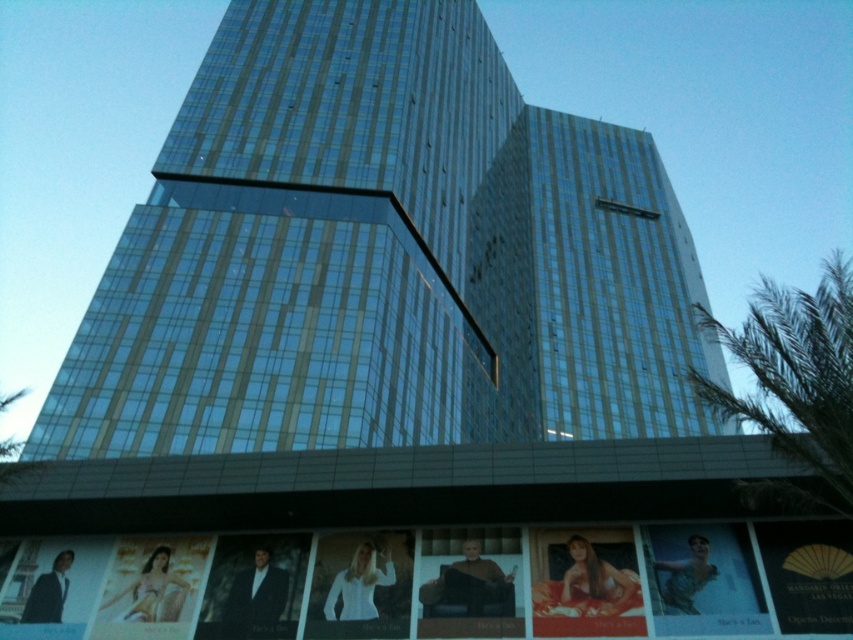
Question: Is glassy metallic building at center thinner than matte black suit at lower left?

Choices:
 (A) no
 (B) yes

Answer: (A)

Question: Observing the image, what is the correct spatial positioning of matte red fabric at center in reference to matte black suit at lower left?

Choices:
 (A) above
 (B) below

Answer: (A)

Question: Which of these objects is positioned farthest from the matte red fabric at center?

Choices:
 (A) matte gold poster at lower left
 (B) matte black poster at lower left
 (C) green leafy palm tree at right

Answer: (C)

Question: Which point is farther to the camera?

Choices:
 (A) (717, 586)
 (B) (370, 609)

Answer: (B)

Question: Which of the following is the closest to the observer?

Choices:
 (A) matte blue dress at lower right
 (B) matte gold poster at lower left

Answer: (A)

Question: Does matte black suit at lower left appear on the right side of matte gold poster at lower left?

Choices:
 (A) no
 (B) yes

Answer: (B)